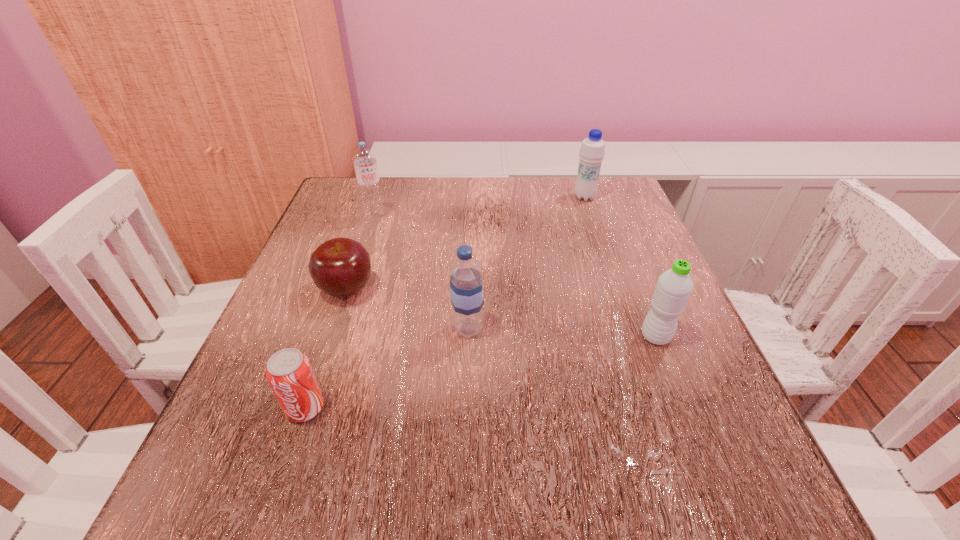
Identify the location of the fifth nearest object. The width and height of the screenshot is (960, 540). (364, 159).

Where is `the second farthest water bottle`? The height and width of the screenshot is (540, 960). the second farthest water bottle is located at coordinates (364, 159).

Identify the location of the farthest water bottle. (592, 151).

This screenshot has width=960, height=540. In order to click on the second water bottle from left to right in this screenshot , I will do `click(466, 288)`.

You are a GUI agent. You are given a task and a screenshot of the screen. Output one action in this format:
    pyautogui.click(x=<x>, y=<y>)
    Task: Click on the fourth nearest object
    
    Given the screenshot: What is the action you would take?
    pyautogui.click(x=340, y=267)

Image resolution: width=960 pixels, height=540 pixels. Identify the location of soda can. (289, 373).

Identify the location of vacant position located 0.050m on the back of the third nearest water bottle. (380, 201).

At what (x,y) coordinates should I click in order to perform the action: click on free space located 0.070m on the left of the farthest water bottle. Please return your answer as a coordinate pair (x, y). The height and width of the screenshot is (540, 960). Looking at the image, I should click on (545, 197).

In order to click on vacant space located 0.160m on the label of the third object from right to left in this screenshot , I will do `click(575, 329)`.

Locate an element on the screen. The width and height of the screenshot is (960, 540). vacant area situated on the back of the apple is located at coordinates (374, 207).